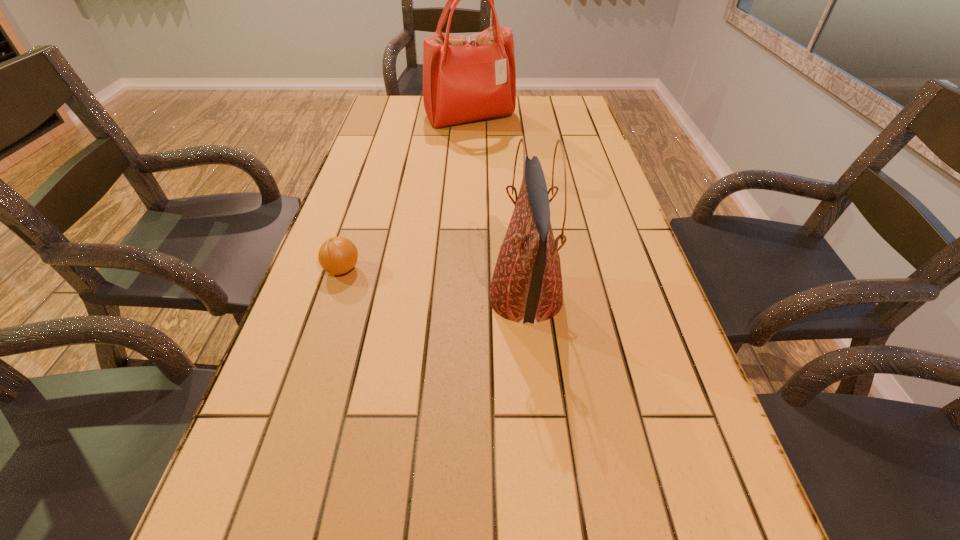
Where is `object at the left edge`? object at the left edge is located at coordinates (338, 255).

The height and width of the screenshot is (540, 960). I want to click on free space at the far edge of the desktop, so click(x=529, y=98).

This screenshot has width=960, height=540. What are the coordinates of `vacant space at the left edge` in the screenshot? It's located at (354, 169).

The height and width of the screenshot is (540, 960). In the image, there is a desktop. Identify the location of vacant space at the right edge. (586, 284).

Where is `vacant space that's between the shortest object and the farthest object`? The image size is (960, 540). vacant space that's between the shortest object and the farthest object is located at coordinates (406, 194).

In order to click on vacant space that is in between the nearer handbag and the shortest object in this screenshot , I will do `click(434, 284)`.

You are a GUI agent. You are given a task and a screenshot of the screen. Output one action in this format:
    pyautogui.click(x=<x>, y=<y>)
    Task: Click on the free spot between the second shortest object and the farthest object
    Image resolution: width=960 pixels, height=540 pixels.
    Given the screenshot: What is the action you would take?
    pyautogui.click(x=498, y=208)

You are a GUI agent. You are given a task and a screenshot of the screen. Output one action in this format:
    pyautogui.click(x=<x>, y=<y>)
    Task: Click on the free spot between the taller handbag and the orange
    Image resolution: width=960 pixels, height=540 pixels.
    Given the screenshot: What is the action you would take?
    pyautogui.click(x=406, y=194)

Identify the location of vacant area that lies between the farthest object and the second tallest object. Image resolution: width=960 pixels, height=540 pixels. (498, 208).

Identify which object is located as the second nearest to the shortest object. Please provide its 2D coordinates. Your answer should be formatted as a tuple, i.e. [(x, y)], where the tuple contains the x and y coordinates of a point satisfying the conditions above.

[(465, 79)]